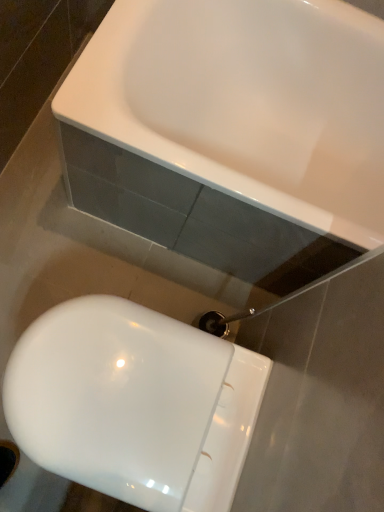
Question: Is white glossy bathtub at upper center inside or outside of white glossy toilet at lower left?

Choices:
 (A) outside
 (B) inside

Answer: (A)

Question: Considering their positions, is white glossy bathtub at upper center located in front of or behind white glossy toilet at lower left?

Choices:
 (A) front
 (B) behind

Answer: (B)

Question: From the image's perspective, is white glossy bathtub at upper center located above or below white glossy toilet at lower left?

Choices:
 (A) above
 (B) below

Answer: (A)

Question: Relative to white glossy bathtub at upper center, is white glossy toilet at lower left in front or behind?

Choices:
 (A) behind
 (B) front

Answer: (B)

Question: From the image's perspective, is white glossy toilet at lower left above or below white glossy bathtub at upper center?

Choices:
 (A) below
 (B) above

Answer: (A)

Question: In terms of height, does white glossy toilet at lower left look taller or shorter compared to white glossy bathtub at upper center?

Choices:
 (A) short
 (B) tall

Answer: (A)

Question: From a real-world perspective, relative to white glossy bathtub at upper center, is white glossy toilet at lower left vertically above or below?

Choices:
 (A) below
 (B) above

Answer: (A)